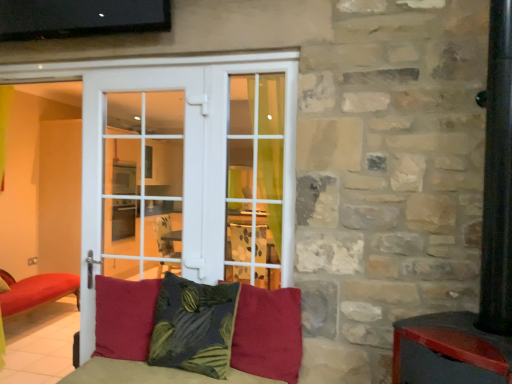
Where is `empty space that is ontop of white glass door at center`? This screenshot has width=512, height=384. empty space that is ontop of white glass door at center is located at coordinates (142, 64).